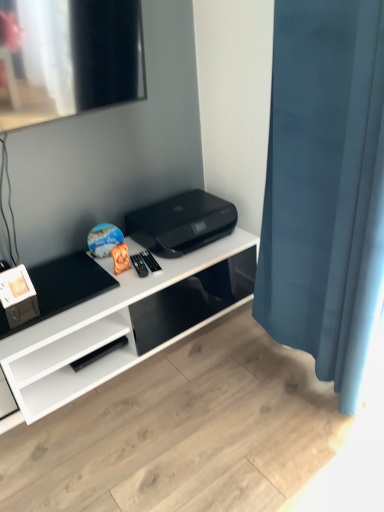
Image resolution: width=384 pixels, height=512 pixels. What are the coordinates of `vacant area situated to the left side of blue velvet curtain at right` in the screenshot? It's located at (221, 387).